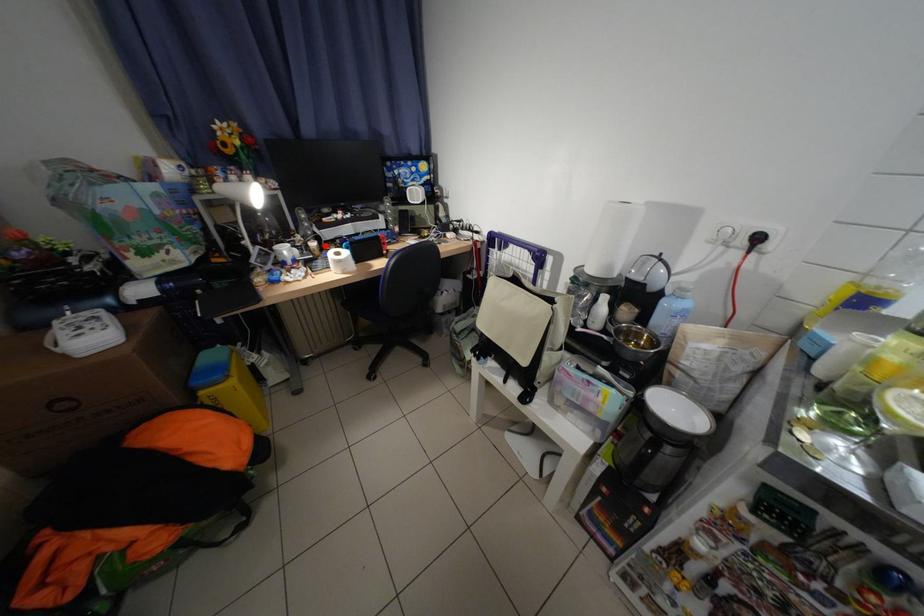
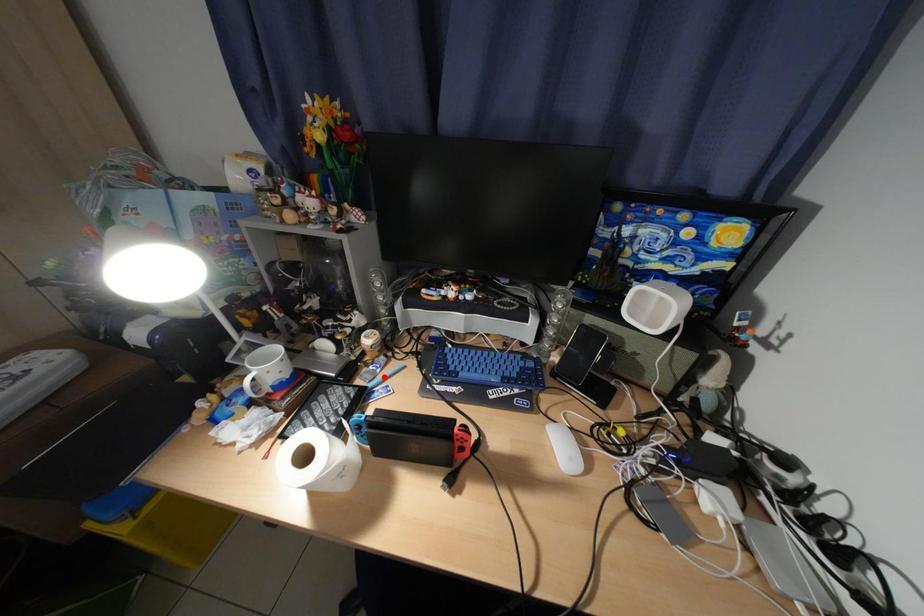
I am providing you with two images of the same scene from different viewpoints. A red point is marked on the first image and another point is marked on the second image. Does the point marked in image1 correspond to the same location as the one in image2?

No